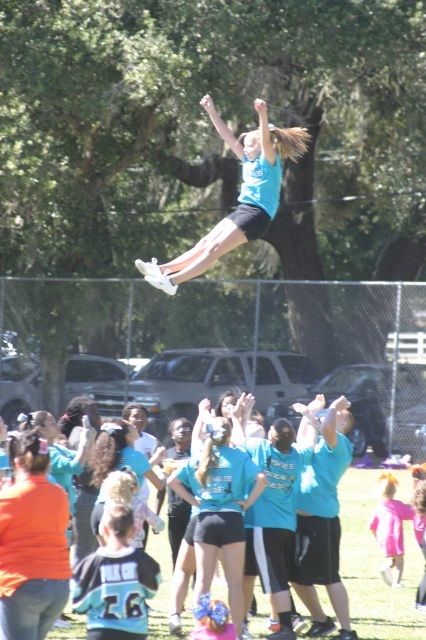
You are standing at a distance and want to take a photo of the matte blue shirt at center. If your camera can focus up to 30 feet, will you be able to capture it clearly?

The matte blue shirt at center is 35.83 feet away from the viewer. Since the camera can only focus up to 30 feet, it will not be able to capture the matte blue shirt at center clearly.

You are a photographer at the event and want to capture a photo where the matte blue shirt at center and the pink satin dress at lower right are both visible. Considering their heights, which one will appear larger in the photo?

The matte blue shirt at center is much taller than the pink satin dress at lower right, so it will appear larger in the photo.